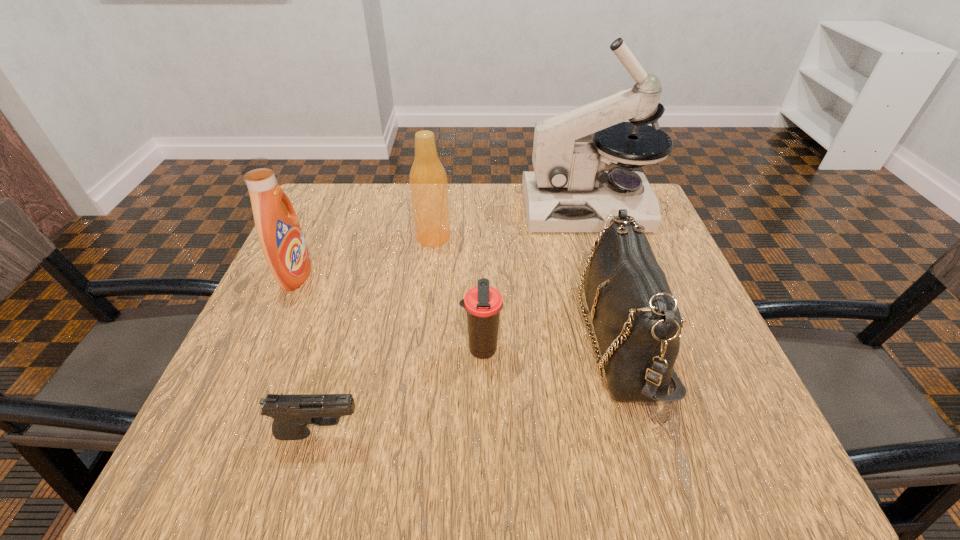
Where is `handbag that is at the near edge`? handbag that is at the near edge is located at coordinates (636, 319).

Identify the location of pistol at the near edge. Image resolution: width=960 pixels, height=540 pixels. (292, 413).

What are the coordinates of `detergent present at the left edge` in the screenshot? It's located at [278, 229].

This screenshot has height=540, width=960. Identify the location of pistol located in the left edge section of the desktop. (292, 413).

Identify the location of microscope located at the right edge. (568, 191).

Where is `handbag that is at the right edge`? This screenshot has height=540, width=960. handbag that is at the right edge is located at coordinates (636, 319).

The image size is (960, 540). Identify the location of object that is positioned at the near left corner. (292, 413).

Identify the location of object located in the far right corner section of the desktop. (568, 191).

Where is `object that is at the near right corner`? The height and width of the screenshot is (540, 960). object that is at the near right corner is located at coordinates (636, 319).

The image size is (960, 540). I want to click on free space at the far edge, so click(x=477, y=221).